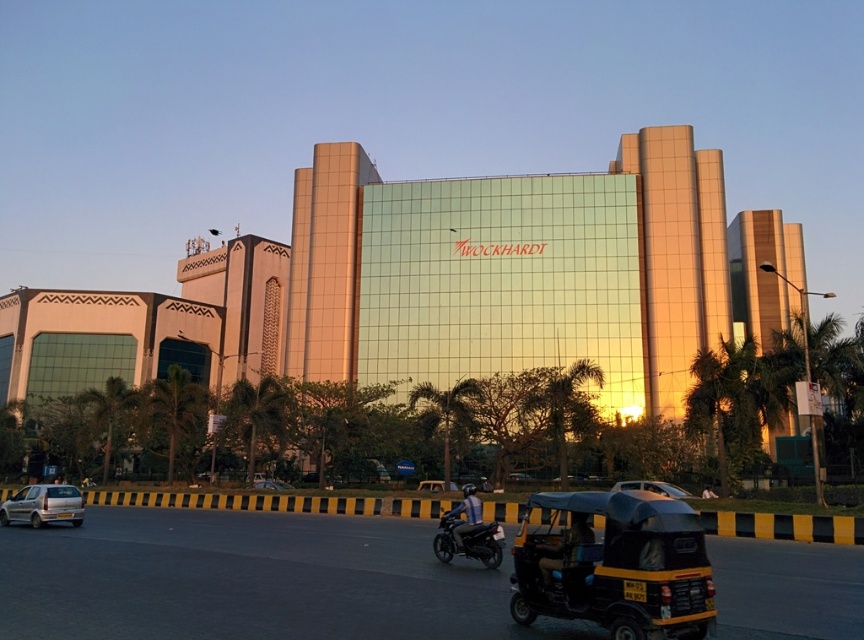
Question: Observing the image, what is the correct spatial positioning of metallic blue motorcycle at center in reference to metallic silver car at center?

Choices:
 (A) below
 (B) above

Answer: (B)

Question: Which point appears farthest from the camera in this image?

Choices:
 (A) (200, 397)
 (B) (494, 544)

Answer: (A)

Question: Is green leafy palm tree at center above metallic silver car at center?

Choices:
 (A) no
 (B) yes

Answer: (B)

Question: Does green leafy palm tree at center have a larger size compared to green leafy palm tree at lower left?

Choices:
 (A) yes
 (B) no

Answer: (B)

Question: Which object appears closest to the camera in this image?

Choices:
 (A) shiny black motorcycle at center
 (B) metallic blue car at center
 (C) metallic silver car at center
 (D) green glass building at center

Answer: (A)

Question: Among these points, which one is nearest to the camera?

Choices:
 (A) (619, 484)
 (B) (465, 547)
 (C) (633, 253)

Answer: (B)